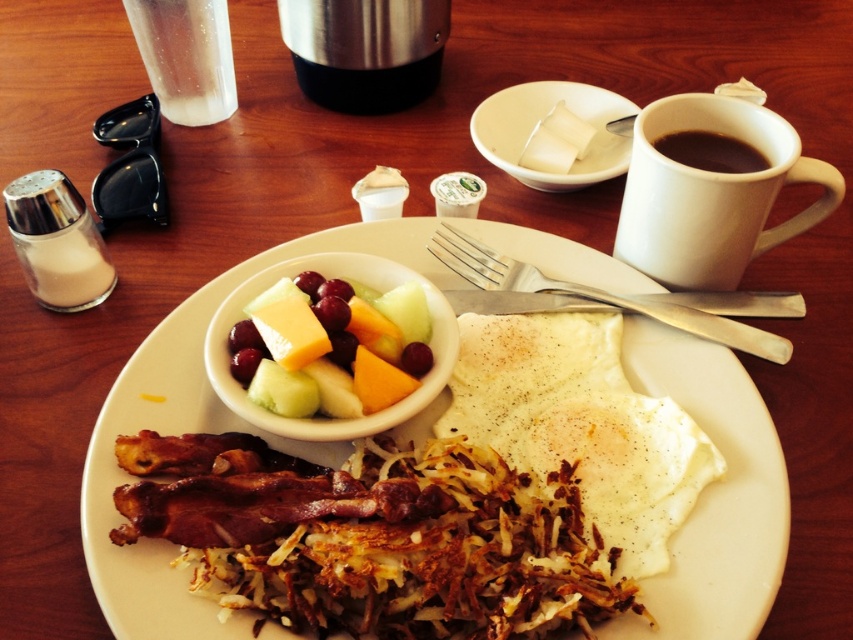
Question: Which point appears closest to the camera in this image?

Choices:
 (A) (306, 339)
 (B) (747, 170)
 (C) (589, 426)
 (D) (677, 170)

Answer: (A)

Question: Which object is positioned closest to the clear plastic cup at upper left?

Choices:
 (A) yellow cheese at center
 (B) black matte cup at upper right
 (C) white matte mug at upper right
 (D) slightly crispy bacon at center

Answer: (A)

Question: Observing the image, what is the correct spatial positioning of white matte mug at upper right in reference to yellow cheese at center?

Choices:
 (A) above
 (B) below

Answer: (A)

Question: Which point appears farthest from the camera in this image?

Choices:
 (A) (273, 346)
 (B) (239, 326)
 (C) (585, 330)
 (D) (692, 244)

Answer: (C)

Question: Is white matte mug at upper right wider than yellow cheese at center?

Choices:
 (A) yes
 (B) no

Answer: (A)

Question: Considering the relative positions of slightly browned fried egg at center and white matte mug at upper right in the image provided, where is slightly browned fried egg at center located with respect to white matte mug at upper right?

Choices:
 (A) below
 (B) above

Answer: (A)